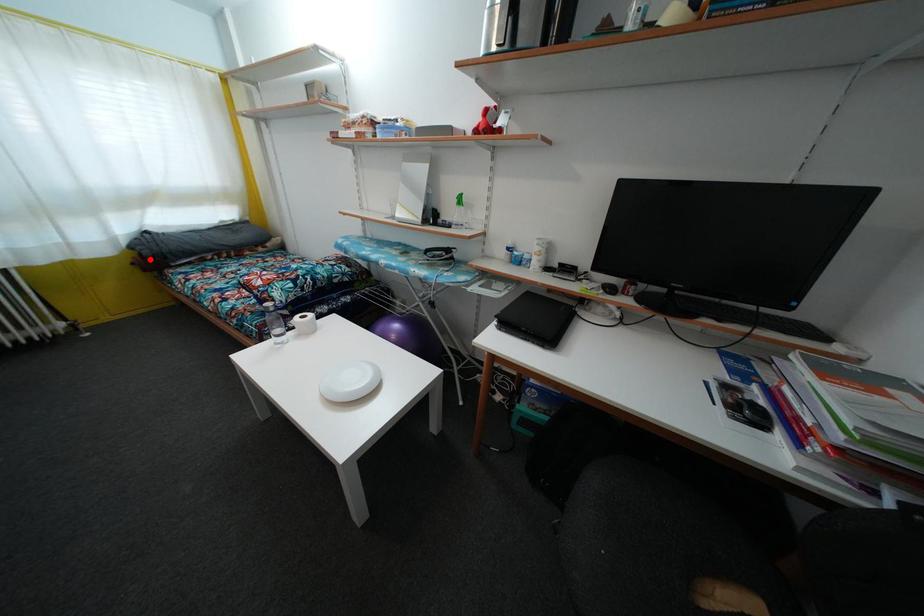
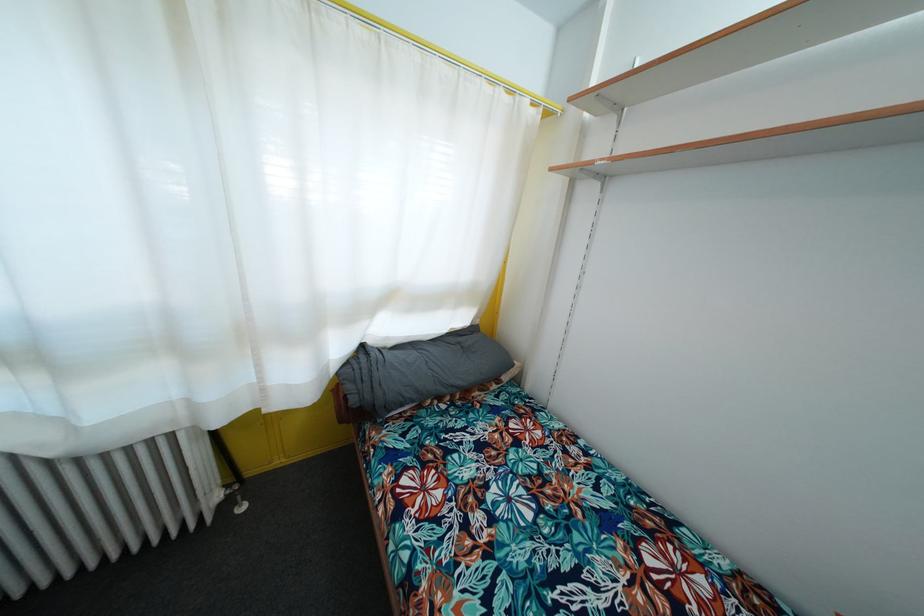
Find the pixel in the second image that matches the highlighted location in the first image.

(358, 407)